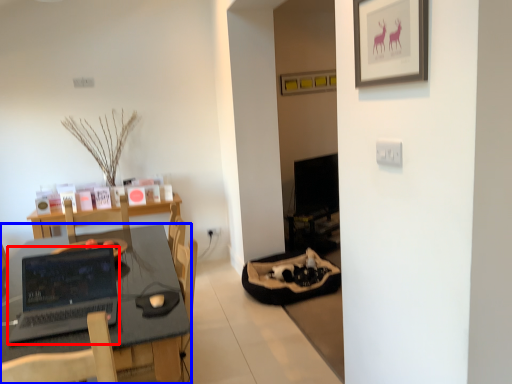
Question: Which object appears closest to the camera in this image, laptop (highlighted by a red box) or desk (highlighted by a blue box)?

Choices:
 (A) laptop
 (B) desk

Answer: (B)